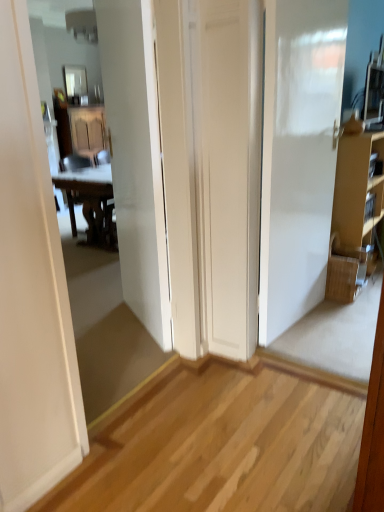
Question: Does brown cardboard cabinet at right have a lesser height compared to glossy glass mirror at upper center?

Choices:
 (A) yes
 (B) no

Answer: (B)

Question: From a real-world perspective, is brown cardboard cabinet at right below glossy glass mirror at upper center?

Choices:
 (A) no
 (B) yes

Answer: (B)

Question: From the image's perspective, is brown cardboard cabinet at right located above glossy glass mirror at upper center?

Choices:
 (A) yes
 (B) no

Answer: (B)

Question: Considering the relative sizes of brown cardboard cabinet at right and glossy glass mirror at upper center in the image provided, is brown cardboard cabinet at right thinner than glossy glass mirror at upper center?

Choices:
 (A) yes
 (B) no

Answer: (B)

Question: Can you confirm if brown cardboard cabinet at right is taller than glossy glass mirror at upper center?

Choices:
 (A) yes
 (B) no

Answer: (A)

Question: Is glossy glass mirror at upper center located within brown cardboard cabinet at right?

Choices:
 (A) no
 (B) yes

Answer: (A)

Question: Is glossy glass mirror at upper center wider than woven brown picnic basket at right?

Choices:
 (A) no
 (B) yes

Answer: (A)

Question: From a real-world perspective, is glossy glass mirror at upper center physically below woven brown picnic basket at right?

Choices:
 (A) no
 (B) yes

Answer: (A)

Question: From a real-world perspective, is glossy glass mirror at upper center physically above woven brown picnic basket at right?

Choices:
 (A) yes
 (B) no

Answer: (A)

Question: Is woven brown picnic basket at right a part of glossy glass mirror at upper center?

Choices:
 (A) yes
 (B) no

Answer: (B)

Question: From the image's perspective, is glossy glass mirror at upper center on woven brown picnic basket at right?

Choices:
 (A) yes
 (B) no

Answer: (A)

Question: Does glossy glass mirror at upper center appear on the left side of woven brown picnic basket at right?

Choices:
 (A) yes
 (B) no

Answer: (A)

Question: Considering the relative sizes of brown cardboard cabinet at right and wooden at left in the image provided, is brown cardboard cabinet at right thinner than wooden at left?

Choices:
 (A) yes
 (B) no

Answer: (A)